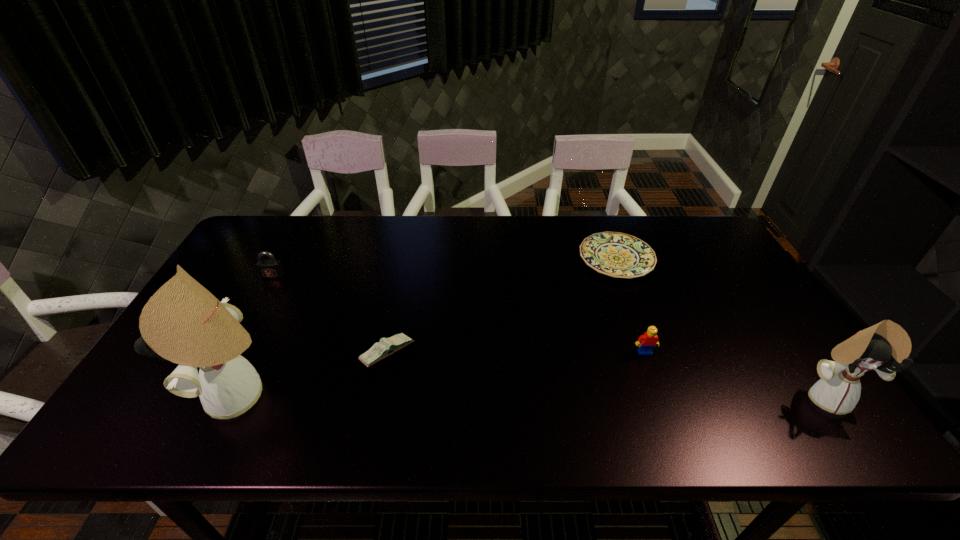
You are a GUI agent. You are given a task and a screenshot of the screen. Output one action in this format:
    pyautogui.click(x=<x>, y=<y>)
    Task: Click on the vacant area located 0.060m at the front face of the left doll
    
    Given the screenshot: What is the action you would take?
    pyautogui.click(x=182, y=395)

Find the location of a particular element. The height and width of the screenshot is (540, 960). free point located at the front face of the left doll is located at coordinates (139, 395).

Identify the location of blank space located on the front of the padlock near the keyhole. (258, 302).

The height and width of the screenshot is (540, 960). Identify the location of free location located 0.220m on the right of the shortest object. (722, 260).

Locate an element on the screen. vacant space located 0.050m on the face of the Lego is located at coordinates (652, 372).

Locate an element on the screen. The width and height of the screenshot is (960, 540). vacant area situated 0.190m on the left of the third object from left to right is located at coordinates (285, 353).

This screenshot has height=540, width=960. I want to click on object that is at the far edge, so click(x=619, y=255).

Where is `diary at the near edge`? The width and height of the screenshot is (960, 540). diary at the near edge is located at coordinates (387, 346).

Locate an element on the screen. This screenshot has width=960, height=540. object at the left edge is located at coordinates (271, 268).

The width and height of the screenshot is (960, 540). What are the coordinates of `object present at the right edge` in the screenshot? It's located at (882, 347).